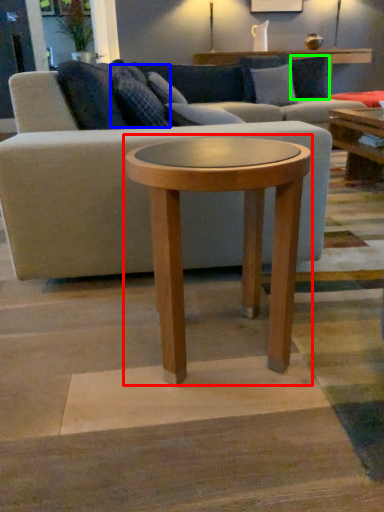
Question: Estimate the real-world distances between objects in this image. Which object is farther from coffee table (highlighted by a red box), pillow (highlighted by a blue box) or pillow (highlighted by a green box)?

Choices:
 (A) pillow
 (B) pillow

Answer: (B)